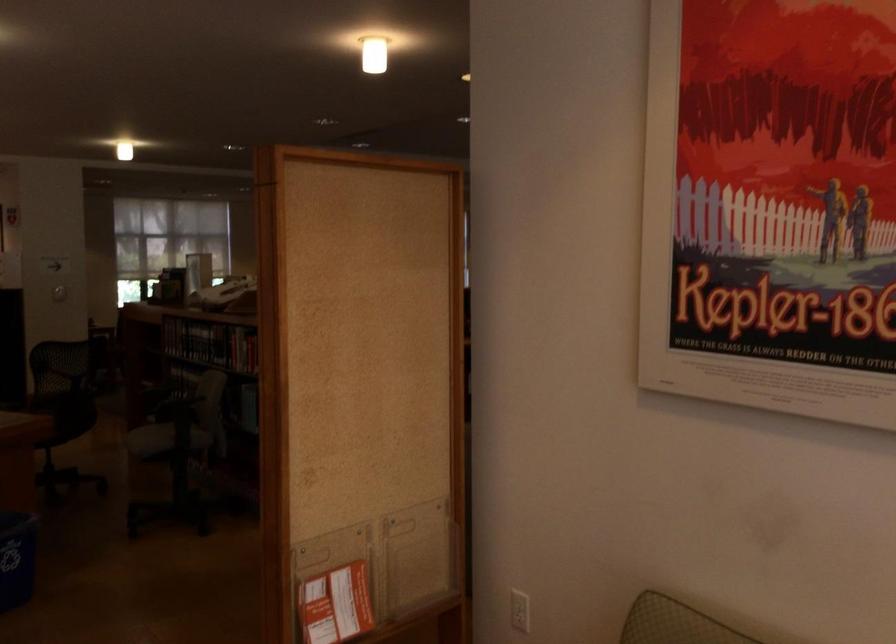
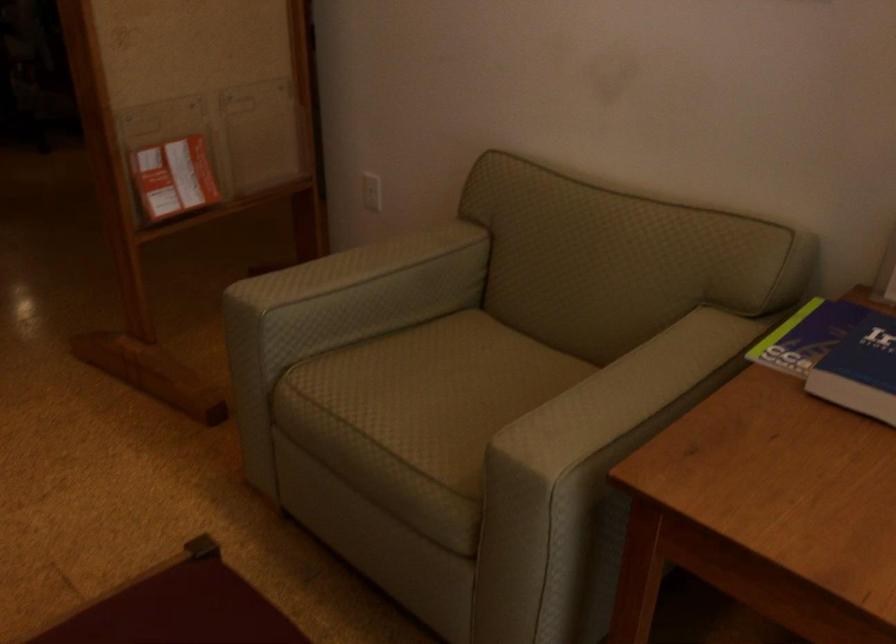
What movement of the cameraman would produce the second image?

Answer: The cameraman walked toward right, forward.